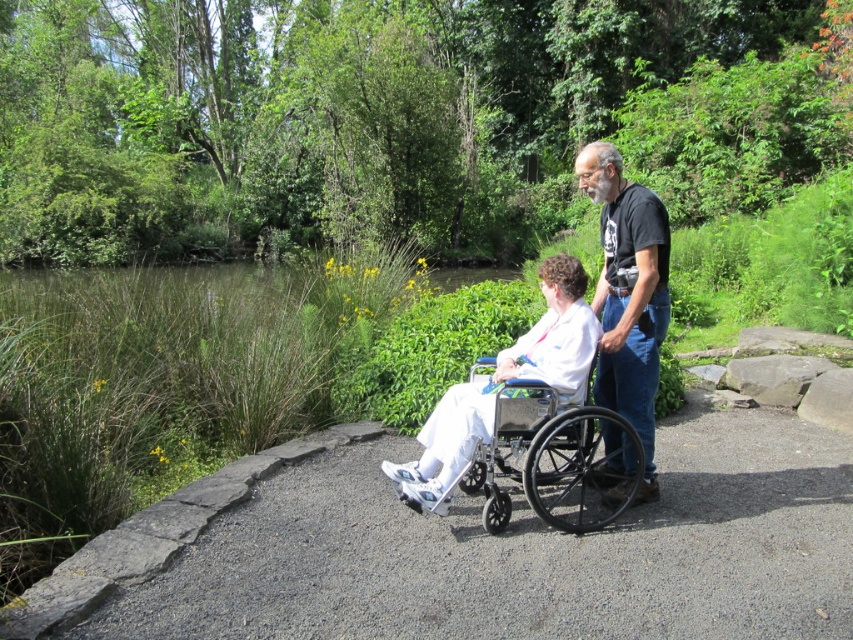
You are standing at the point marked by coordinates point (x=554, y=460) in the image. What object are you directly at?

You are directly at the metallic silver wheelchair at center.